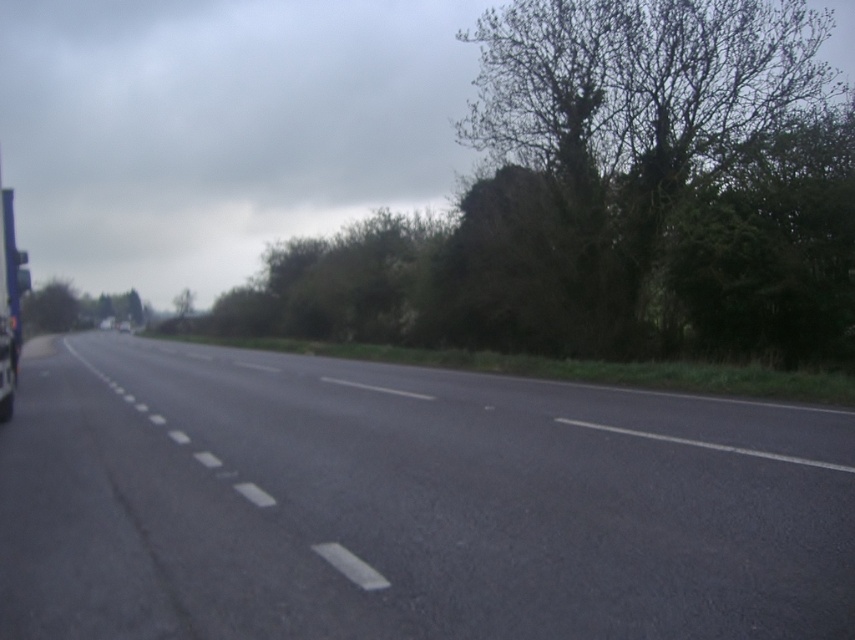
You are a driver approaching the intersection ahead. You notice a green leafy tree at upper right and a metallic silver trailer truck at left. Which object takes up more space in the scene?

The metallic silver trailer truck at left occupies more space than the green leafy tree at upper right.

You are a driver approaching the intersection ahead. You notice a green leafy tree at upper right and a metallic silver trailer truck at left. Which object is taller?

The green leafy tree at upper right is taller than the metallic silver trailer truck at left according to the description.

You are a self driving car navigating the two lane road. You see two points on the road ahead, point (12,253) and point (36,321). Which point is closer to your current position?

Answer: Point (12,253) is in front of point (36,321), so it is closer to your current position.